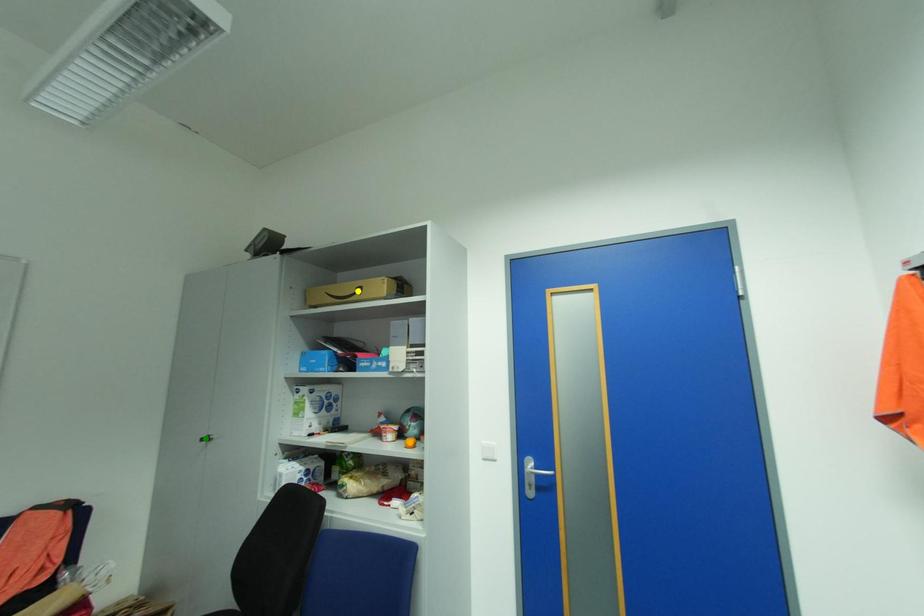
In the scene shown: Order these from farthest to nearest:
yellow point, green point, orange point

green point < yellow point < orange point